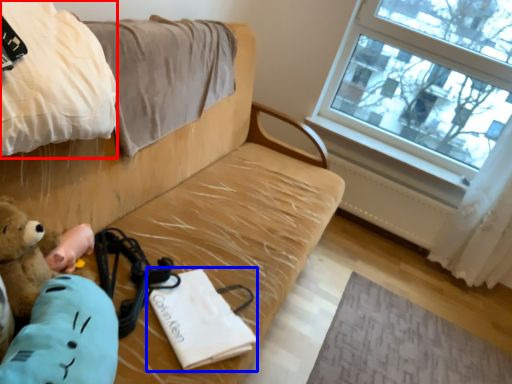
Question: Which object appears farthest to the camera in this image, blanket (highlighted by a red box) or journal (highlighted by a blue box)?

Choices:
 (A) blanket
 (B) journal

Answer: (B)